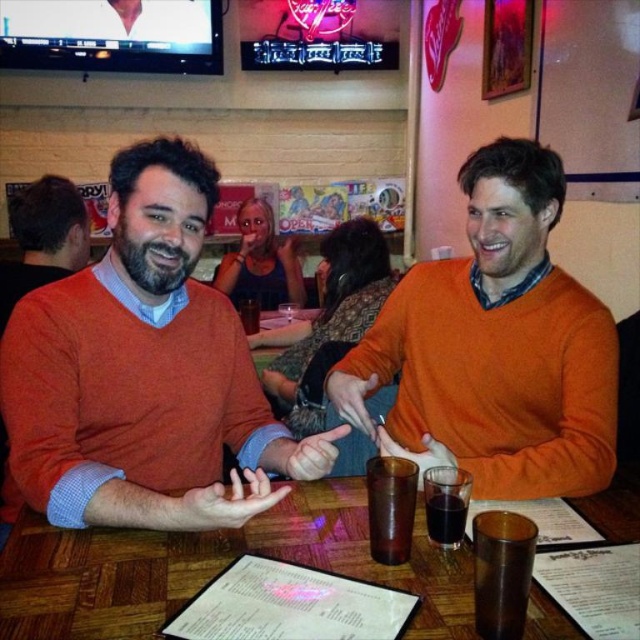
You are a server at this establishment and need to place a new drink order on the table. The drink requires a taller glass. Which glass should you choose between the brown glass at table center and the translucent glass at center?

The brown glass at table center is taller than the translucent glass at center, so you should choose the brown glass at table center for the drink that requires a taller glass.

You are a server at the restaurant and need to deliver a drink to the table. The drink you are carrying is the same size as the dark brown liquid at table center. Is there enough space on the table to place the drink next to the matte orange sweater at left?

The matte orange sweater at left is bigger than the dark brown liquid at table center. Since the sweater is larger, there might still be enough space on the table to place the drink next to it, but the exact availability depends on the table size and other items present.

You are a waiter in a restaurant and need to place a dessert menu on the table. The matte orange sweater at left and the dark brown liquid at table center are already on the table. Where should you place the dessert menu so it doesn not obstruct either object?

You should place the dessert menu behind the matte orange sweater at left since it is in front of the dark brown liquid at table center, allowing space behind the sweater to avoid blocking either object.